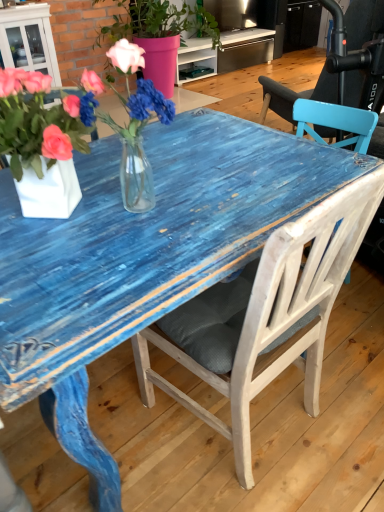
What do you see at coordinates (264, 316) in the screenshot?
I see `white wood chair at center` at bounding box center [264, 316].

What do you see at coordinates (41, 144) in the screenshot? The width and height of the screenshot is (384, 512). I see `white matte vase at left, arranged as the 1th houseplant when viewed from the front` at bounding box center [41, 144].

The height and width of the screenshot is (512, 384). What do you see at coordinates (64, 135) in the screenshot?
I see `translucent glass vase at center` at bounding box center [64, 135].

Locate an element on the screen. white wood chair at center is located at coordinates (264, 316).

Does pink matte vase at upper center, positioned as the second houseplant in front-to-back order, appear on the left side of white wood chair at center?

Yes.

Does point (144, 76) come behind point (366, 189)?

Yes, it is.

Is pink matte vase at upper center, the first houseplant in the top-to-bottom sequence, far from white wood chair at center?

pink matte vase at upper center, the first houseplant in the top-to-bottom sequence, is far away from white wood chair at center.

Is pink matte vase at upper center, placed as the second houseplant when sorted from bottom to top, facing away from white wood chair at center?

No, pink matte vase at upper center, placed as the second houseplant when sorted from bottom to top, is not facing the opposite direction of white wood chair at center.

Considering the points (10, 124) and (49, 84), which point is behind, point (10, 124) or point (49, 84)?

Point (49, 84)

Is white matte vase at left, which is the 2th houseplant from back to front, at the left side of translucent glass vase at center?

Indeed, white matte vase at left, which is the 2th houseplant from back to front, is positioned on the left side of translucent glass vase at center.

Is white matte vase at left, the 2th houseplant in the top-to-bottom sequence, inside or outside of translucent glass vase at center?

white matte vase at left, the 2th houseplant in the top-to-bottom sequence, is not enclosed by translucent glass vase at center.

Is white matte vase at left, which is the 2th houseplant from back to front, inside the boundaries of pink matte vase at upper center, placed as the second houseplant when sorted from bottom to top, or outside?

white matte vase at left, which is the 2th houseplant from back to front, is spatially situated outside pink matte vase at upper center, placed as the second houseplant when sorted from bottom to top.

What's the angular difference between white matte vase at left, the 2th houseplant in the top-to-bottom sequence, and pink matte vase at upper center, positioned as the second houseplant in front-to-back order,'s facing directions?

The angular difference between white matte vase at left, the 2th houseplant in the top-to-bottom sequence, and pink matte vase at upper center, positioned as the second houseplant in front-to-back order, is 139 degrees.

Does point (18, 104) lie in front of point (164, 49)?

That is True.

Considering the sizes of white matte vase at left, arranged as the 1th houseplant when viewed from the front, and pink matte vase at upper center, positioned as the second houseplant in front-to-back order, in the image, is white matte vase at left, arranged as the 1th houseplant when viewed from the front, bigger or smaller than pink matte vase at upper center, positioned as the second houseplant in front-to-back order,?

white matte vase at left, arranged as the 1th houseplant when viewed from the front, is smaller than pink matte vase at upper center, positioned as the second houseplant in front-to-back order.

Are white wood chair at center and translucent glass vase at center far apart?

Actually, white wood chair at center and translucent glass vase at center are a little close together.

From the picture: Between white wood chair at center and translucent glass vase at center, which one has smaller width?

Thinner between the two is translucent glass vase at center.

Is white wood chair at center completely or partially outside of translucent glass vase at center?

Absolutely, white wood chair at center is external to translucent glass vase at center.

Locate an element on the screen. Image resolution: width=384 pixels, height=512 pixels. floral arrangement that is on the left side of white wood chair at center is located at coordinates (64, 135).

Is white wood chair at center taller or shorter than white matte vase at left, arranged as the first houseplant when ordered from the bottom?

Clearly, white wood chair at center is taller compared to white matte vase at left, arranged as the first houseplant when ordered from the bottom.

Is point (273, 279) behind point (19, 195)?

No, (273, 279) is closer to viewer.

From the image's perspective, who appears lower, white wood chair at center or white matte vase at left, arranged as the 1th houseplant when viewed from the front?

white wood chair at center, from the image's perspective.

Which of these two, translucent glass vase at center or white matte vase at left, the 2th houseplant in the top-to-bottom sequence, stands taller?

translucent glass vase at center.

Is translucent glass vase at center smaller than white matte vase at left, arranged as the first houseplant when ordered from the bottom?

Correct, translucent glass vase at center occupies less space than white matte vase at left, arranged as the first houseplant when ordered from the bottom.

Based on the photo, how much distance is there between translucent glass vase at center and white matte vase at left, the 2th houseplant in the top-to-bottom sequence?

The distance of translucent glass vase at center from white matte vase at left, the 2th houseplant in the top-to-bottom sequence, is 2.08 centimeters.

Would you say white matte vase at left, which is the 2th houseplant from back to front, is part of translucent glass vase at center's contents?

No, white matte vase at left, which is the 2th houseplant from back to front, is located outside of translucent glass vase at center.

From a real-world perspective, does pink matte vase at upper center, placed as the second houseplant when sorted from bottom to top, stand above white matte vase at left, which is the 2th houseplant from back to front?

No, from a real-world perspective, pink matte vase at upper center, placed as the second houseplant when sorted from bottom to top, is not over white matte vase at left, which is the 2th houseplant from back to front

From the picture: From the image's perspective, is pink matte vase at upper center, the first houseplant in the top-to-bottom sequence, positioned above or below white matte vase at left, the 2th houseplant in the top-to-bottom sequence?

Based on their image positions, pink matte vase at upper center, the first houseplant in the top-to-bottom sequence, is located above white matte vase at left, the 2th houseplant in the top-to-bottom sequence.

Is pink matte vase at upper center, which is the first houseplant in back-to-front order, aimed at white matte vase at left, the 2th houseplant in the top-to-bottom sequence?

No, pink matte vase at upper center, which is the first houseplant in back-to-front order, is not aimed at white matte vase at left, the 2th houseplant in the top-to-bottom sequence.

Considering the positions of objects pink matte vase at upper center, the first houseplant in the top-to-bottom sequence, and white matte vase at left, arranged as the first houseplant when ordered from the bottom, in the image provided, who is in front, pink matte vase at upper center, the first houseplant in the top-to-bottom sequence, or white matte vase at left, arranged as the first houseplant when ordered from the bottom,?

white matte vase at left, arranged as the first houseplant when ordered from the bottom, is more forward.

Starting from the white wood chair at center, which houseplant is the 2nd one behind? Please provide its 2D coordinates.

[(159, 34)]

This screenshot has height=512, width=384. What are the coordinates of `the 2nd houseplant to the left when counting from the translucent glass vase at center` in the screenshot? It's located at point(41,144).

Which object lies nearer to the anchor point translucent glass vase at center, pink matte vase at upper center, placed as the second houseplant when sorted from bottom to top, or white matte vase at left, arranged as the 1th houseplant when viewed from the front?

Based on the image, white matte vase at left, arranged as the 1th houseplant when viewed from the front, appears to be nearer to translucent glass vase at center.

Estimate the real-world distances between objects in this image. Which object is closer to white matte vase at left, the 2th houseplant in the top-to-bottom sequence, pink matte vase at upper center, positioned as the second houseplant in front-to-back order, or translucent glass vase at center?

Among the two, translucent glass vase at center is located nearer to white matte vase at left, the 2th houseplant in the top-to-bottom sequence.

Based on their spatial positions, is white matte vase at left, the 2th houseplant in the top-to-bottom sequence, or translucent glass vase at center closer to white wood chair at center?

translucent glass vase at center is closer to white wood chair at center.

From the image, which object appears to be nearer to pink matte vase at upper center, the first houseplant in the top-to-bottom sequence, translucent glass vase at center or white matte vase at left, which is the 2th houseplant from back to front?

white matte vase at left, which is the 2th houseplant from back to front, lies closer to pink matte vase at upper center, the first houseplant in the top-to-bottom sequence, than the other object.

Estimate the real-world distances between objects in this image. Which object is closer to white matte vase at left, arranged as the 1th houseplant when viewed from the front, white wood chair at center or translucent glass vase at center?

translucent glass vase at center.

Based on their spatial positions, is white wood chair at center or translucent glass vase at center closer to pink matte vase at upper center, positioned as the second houseplant in front-to-back order?

white wood chair at center lies closer to pink matte vase at upper center, positioned as the second houseplant in front-to-back order, than the other object.

Looking at the image, which one is located closer to pink matte vase at upper center, the first houseplant in the top-to-bottom sequence, translucent glass vase at center or white wood chair at center?

The object closer to pink matte vase at upper center, the first houseplant in the top-to-bottom sequence, is white wood chair at center.

Estimate the real-world distances between objects in this image. Which object is closer to white matte vase at left, which is the 2th houseplant from back to front, white wood chair at center or pink matte vase at upper center, which is the first houseplant in back-to-front order?

The object closer to white matte vase at left, which is the 2th houseplant from back to front, is white wood chair at center.

The image size is (384, 512). What are the coordinates of `floral arrangement between white matte vase at left, arranged as the first houseplant when ordered from the bottom, and white wood chair at center from left to right` in the screenshot? It's located at (64, 135).

Image resolution: width=384 pixels, height=512 pixels. In order to click on houseplant between white wood chair at center and pink matte vase at upper center, the first houseplant in the top-to-bottom sequence, from front to back in this screenshot , I will do `click(41, 144)`.

Find the location of a particular element. floral arrangement between white wood chair at center and pink matte vase at upper center, positioned as the second houseplant in front-to-back order, from front to back is located at coordinates (64, 135).

You are a GUI agent. You are given a task and a screenshot of the screen. Output one action in this format:
    pyautogui.click(x=<x>, y=<y>)
    Task: Click on the floral arrangement between white matte vase at left, arranged as the first houseplant when ordered from the bottom, and pink matte vase at upper center, positioned as the second houseplant in front-to-back order, along the z-axis
    This screenshot has height=512, width=384.
    Given the screenshot: What is the action you would take?
    pyautogui.click(x=64, y=135)